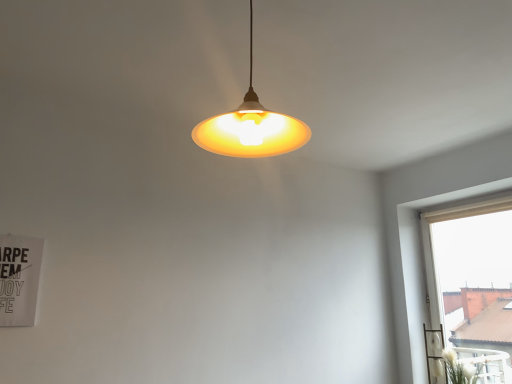
Question: Is matte yellow plastic lampshade at center to the left of white fluffy plant at lower right from the viewer's perspective?

Choices:
 (A) yes
 (B) no

Answer: (A)

Question: Does matte yellow plastic lampshade at center have a lesser width compared to white fluffy plant at lower right?

Choices:
 (A) no
 (B) yes

Answer: (A)

Question: From the image's perspective, does matte yellow plastic lampshade at center appear lower than white fluffy plant at lower right?

Choices:
 (A) yes
 (B) no

Answer: (B)

Question: Does matte yellow plastic lampshade at center have a smaller size compared to white fluffy plant at lower right?

Choices:
 (A) yes
 (B) no

Answer: (B)

Question: Can you confirm if matte yellow plastic lampshade at center is wider than white fluffy plant at lower right?

Choices:
 (A) yes
 (B) no

Answer: (A)

Question: From the image's perspective, relative to white fluffy plant at lower right, is matte yellow plastic lampshade at center above or below?

Choices:
 (A) above
 (B) below

Answer: (A)

Question: Is matte yellow plastic lampshade at center inside the boundaries of white fluffy plant at lower right, or outside?

Choices:
 (A) outside
 (B) inside

Answer: (A)

Question: From a real-world perspective, is matte yellow plastic lampshade at center physically located above or below white fluffy plant at lower right?

Choices:
 (A) below
 (B) above

Answer: (B)

Question: Is point (196, 125) positioned closer to the camera than point (464, 369)?

Choices:
 (A) closer
 (B) farther

Answer: (A)

Question: Is white fluffy plant at lower right wider or thinner than matte yellow plastic lampshade at center?

Choices:
 (A) wide
 (B) thin

Answer: (B)

Question: Which is correct: white fluffy plant at lower right is inside matte yellow plastic lampshade at center, or outside of it?

Choices:
 (A) inside
 (B) outside

Answer: (B)

Question: Considering the positions of white fluffy plant at lower right and matte yellow plastic lampshade at center in the image, is white fluffy plant at lower right taller or shorter than matte yellow plastic lampshade at center?

Choices:
 (A) short
 (B) tall

Answer: (A)

Question: Relative to matte yellow plastic lampshade at center, is white fluffy plant at lower right in front or behind?

Choices:
 (A) behind
 (B) front

Answer: (A)

Question: From the image's perspective, is white fluffy plant at lower right located above or below beige fabric curtain at right?

Choices:
 (A) below
 (B) above

Answer: (A)

Question: Considering the relative positions of white fluffy plant at lower right and beige fabric curtain at right in the image provided, is white fluffy plant at lower right to the left or to the right of beige fabric curtain at right?

Choices:
 (A) left
 (B) right

Answer: (A)